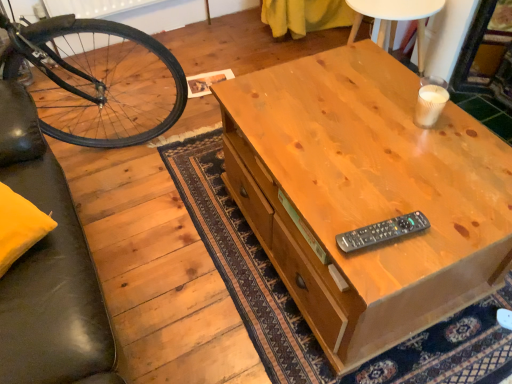
Where is `vacant space to the right of black plastic remote at center`? vacant space to the right of black plastic remote at center is located at coordinates (442, 221).